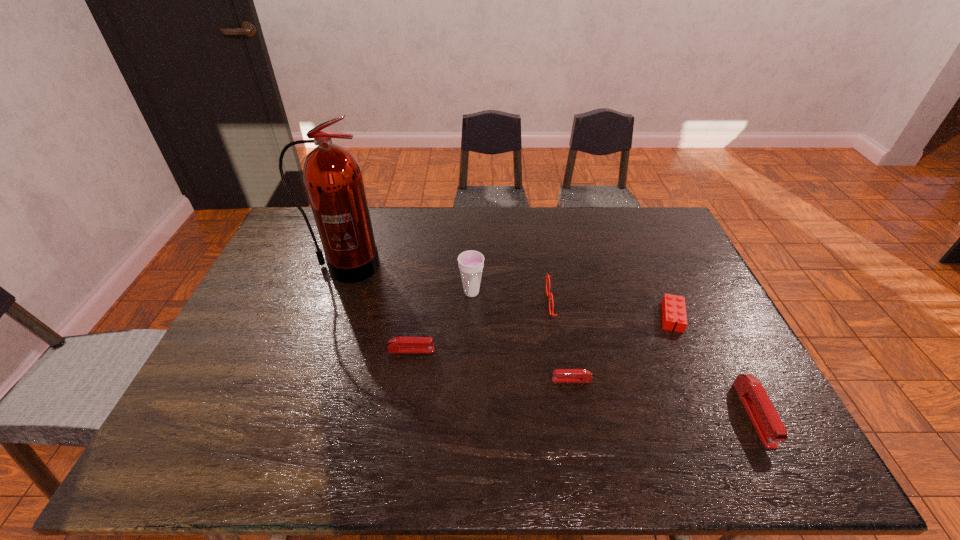
In order to click on spectacles in this screenshot , I will do `click(549, 294)`.

The width and height of the screenshot is (960, 540). In order to click on vacant position located 0.400m on the front-facing side of the leftmost stapler in this screenshot , I will do `click(583, 350)`.

This screenshot has height=540, width=960. In order to click on free point located on the front-facing side of the second stapler from right to left in this screenshot , I will do `click(473, 380)`.

Identify the location of vacant space located on the front-facing side of the second stapler from right to left. The width and height of the screenshot is (960, 540). tap(414, 380).

The image size is (960, 540). In order to click on vacant space located 0.110m on the front-facing side of the second stapler from right to left in this screenshot , I will do `click(509, 380)`.

Locate an element on the screen. Image resolution: width=960 pixels, height=540 pixels. vacant point located 0.150m on the back of the Lego is located at coordinates (651, 269).

Where is `free space located on the front-facing side of the tallest object`? This screenshot has height=540, width=960. free space located on the front-facing side of the tallest object is located at coordinates point(329,311).

The image size is (960, 540). What are the coordinates of `free space located on the left of the fifth object from right to left` in the screenshot? It's located at (414, 292).

At what (x,y) coordinates should I click in order to perform the action: click on free location located 0.270m on the front-facing side of the spectacles. Please return your answer as a coordinate pair (x, y). The width and height of the screenshot is (960, 540). Looking at the image, I should click on (458, 303).

This screenshot has width=960, height=540. In order to click on vacant space situated 0.290m on the front-facing side of the spectacles in this screenshot , I will do `click(451, 303)`.